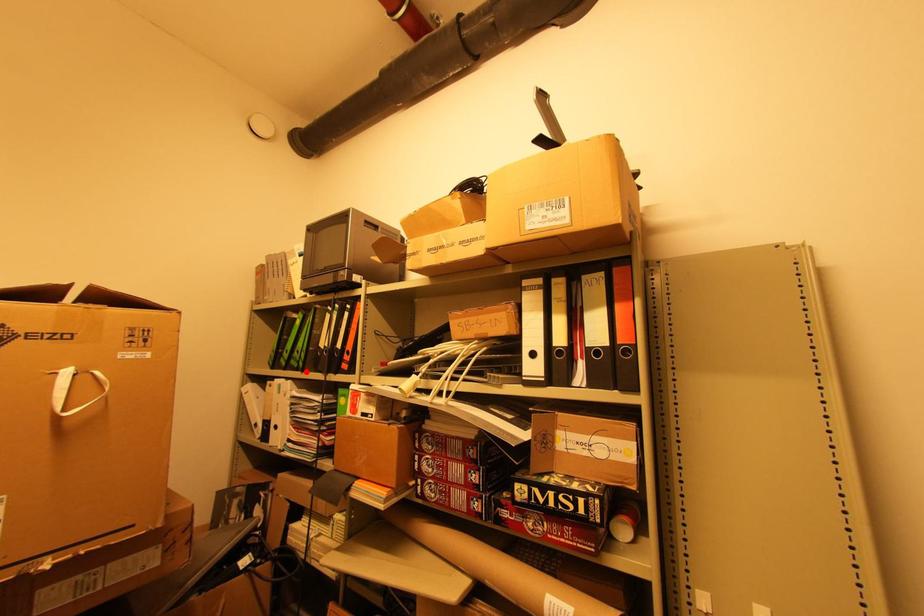
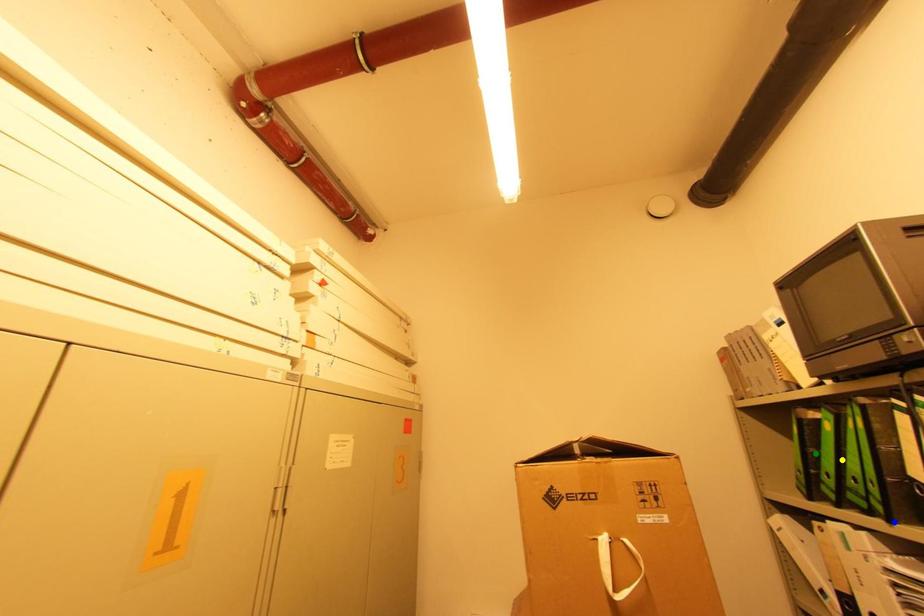
Question: I am providing you with two images of the same scene from different viewpoints. A red point is marked on the first image. You are given multiple points on the second image. In image 2, which mark is for the same physical point as the one in image 1?

Choices:
 (A) yellow point
 (B) blue point
 (C) green point

Answer: (B)